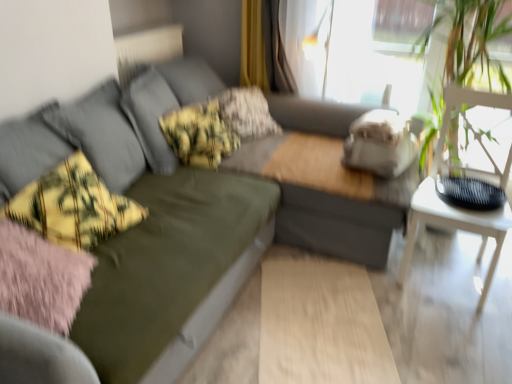
Question: Which direction should I rotate to face yellow-green plaid pillow at center, the 1th pillow in the front-to-back sequence, — up or down?

Choices:
 (A) down
 (B) up

Answer: (B)

Question: Is the position of floral fabric pillow at center, marked as the 2th pillow in a front-to-back arrangement, more distant than that of yellow-green plaid throw pillow at left?

Choices:
 (A) yes
 (B) no

Answer: (A)

Question: Does floral fabric pillow at center, acting as the 1th pillow starting from the back, have a lesser height compared to yellow-green plaid throw pillow at left?

Choices:
 (A) no
 (B) yes

Answer: (A)

Question: From a real-world perspective, is floral fabric pillow at center, marked as the 2th pillow in a front-to-back arrangement, located higher than yellow-green plaid throw pillow at left?

Choices:
 (A) yes
 (B) no

Answer: (B)

Question: Is the depth of floral fabric pillow at center, marked as the 2th pillow in a front-to-back arrangement, less than that of yellow-green plaid throw pillow at left?

Choices:
 (A) no
 (B) yes

Answer: (A)

Question: Does floral fabric pillow at center, marked as the 2th pillow in a front-to-back arrangement, have a greater height compared to yellow-green plaid throw pillow at left?

Choices:
 (A) yes
 (B) no

Answer: (A)

Question: From the image's perspective, is floral fabric pillow at center, marked as the 2th pillow in a front-to-back arrangement, beneath yellow-green plaid throw pillow at left?

Choices:
 (A) no
 (B) yes

Answer: (A)

Question: Is olive green fabric couch at center turned away from yellow-green plaid pillow at center, the 1th pillow in the front-to-back sequence?

Choices:
 (A) yes
 (B) no

Answer: (B)

Question: Is olive green fabric couch at center bigger than yellow-green plaid pillow at center, the 1th pillow in the front-to-back sequence?

Choices:
 (A) yes
 (B) no

Answer: (A)

Question: Could you tell me if olive green fabric couch at center is turned towards yellow-green plaid pillow at center, the 1th pillow in the front-to-back sequence?

Choices:
 (A) yes
 (B) no

Answer: (B)

Question: Considering the relative positions of olive green fabric couch at center and yellow-green plaid pillow at center, which is the 2th pillow from back to front, in the image provided, is olive green fabric couch at center to the right of yellow-green plaid pillow at center, which is the 2th pillow from back to front, from the viewer's perspective?

Choices:
 (A) yes
 (B) no

Answer: (A)

Question: Is the surface of olive green fabric couch at center in direct contact with yellow-green plaid pillow at center, which is the 2th pillow from back to front?

Choices:
 (A) no
 (B) yes

Answer: (A)

Question: Is olive green fabric couch at center to the left of yellow-green plaid pillow at center, the 1th pillow in the front-to-back sequence, from the viewer's perspective?

Choices:
 (A) no
 (B) yes

Answer: (A)

Question: Is white wooden table at right not inside yellow-green plaid throw pillow at left?

Choices:
 (A) no
 (B) yes

Answer: (B)